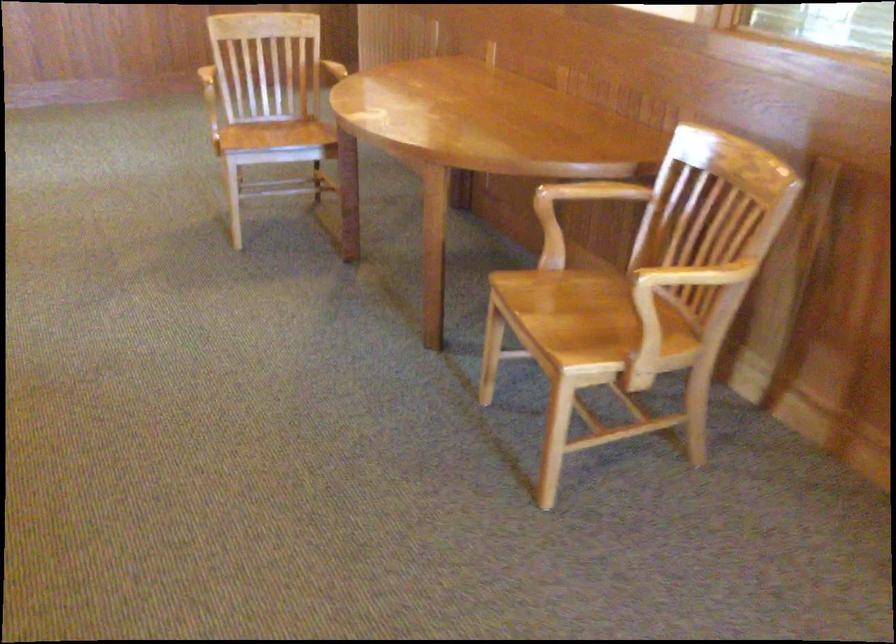
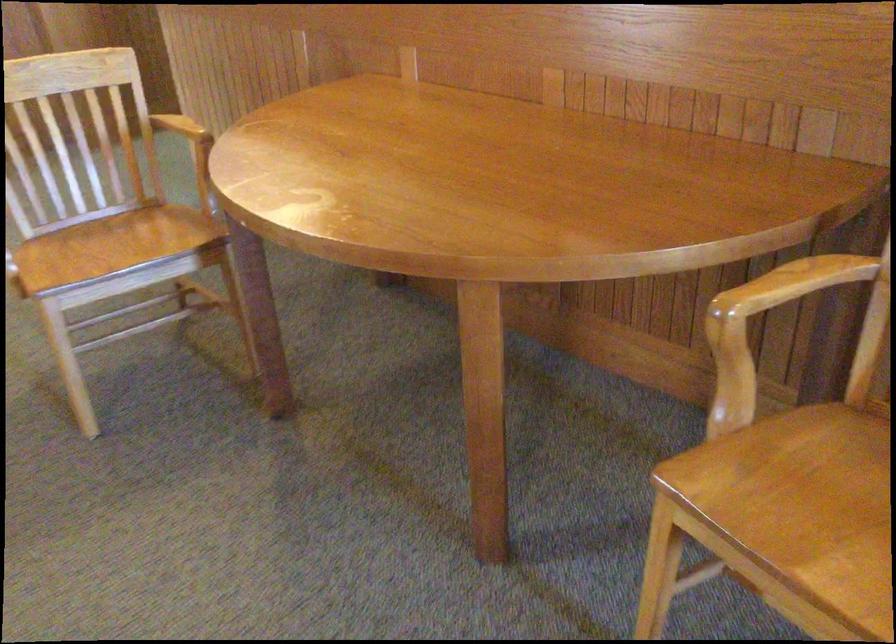
In a continuous first-person perspective shot, in which direction is the camera moving?

The cameraman moved toward left, forward.